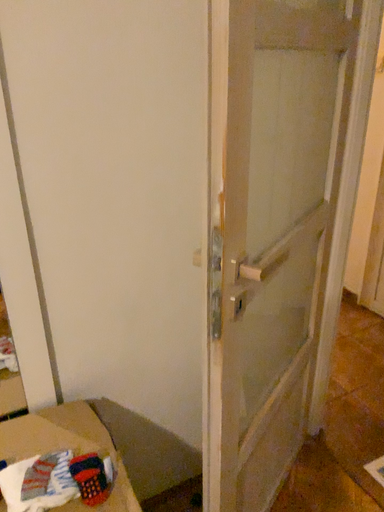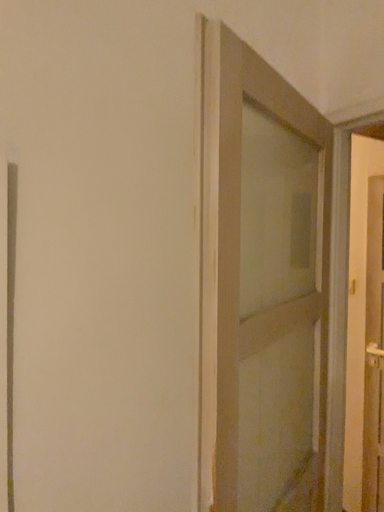
Question: Which way did the camera rotate in the video?

Choices:
 (A) rotated upward
 (B) rotated downward

Answer: (A)